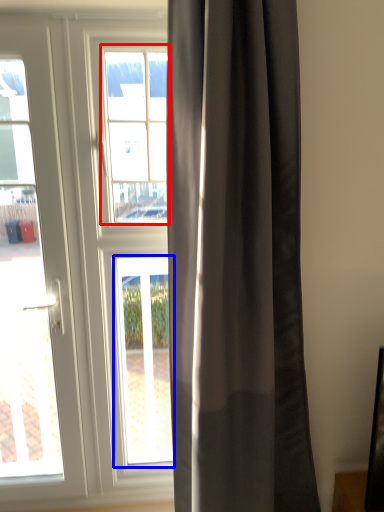
Question: Which point is closer to the camera, bay window (highlighted by a red box) or window (highlighted by a blue box)?

Choices:
 (A) bay window
 (B) window

Answer: (A)